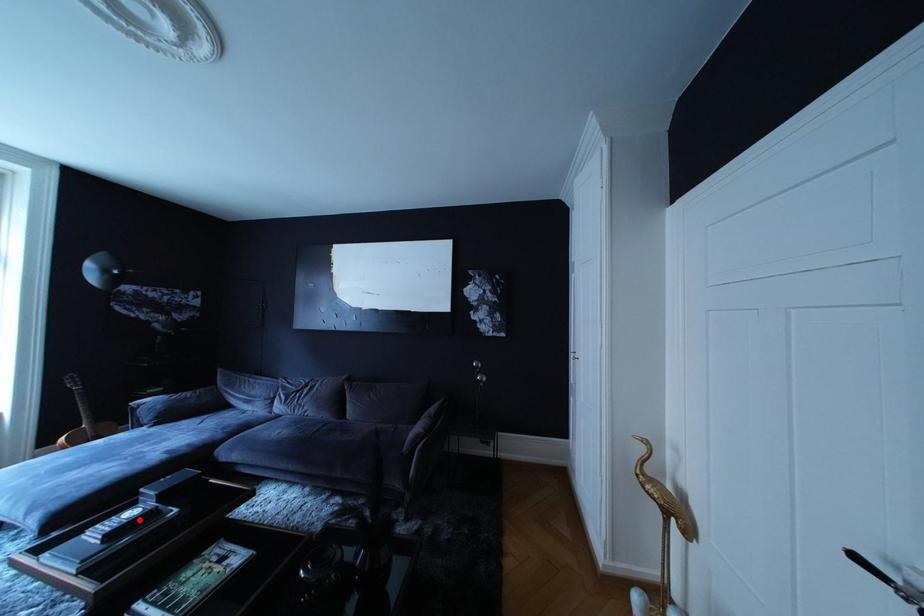
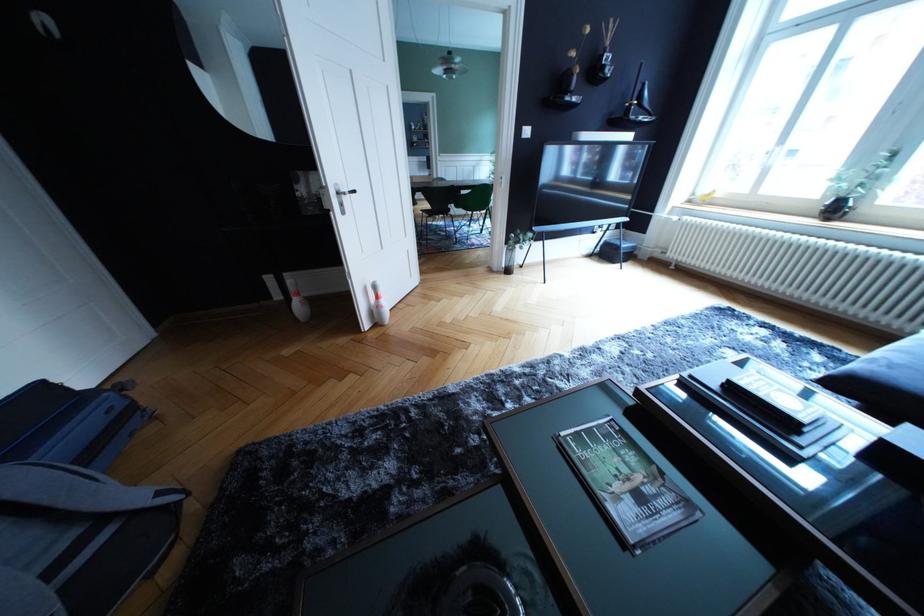
The point at the highlighted location is marked in the first image. Where is the corresponding point in the second image?

(793, 405)